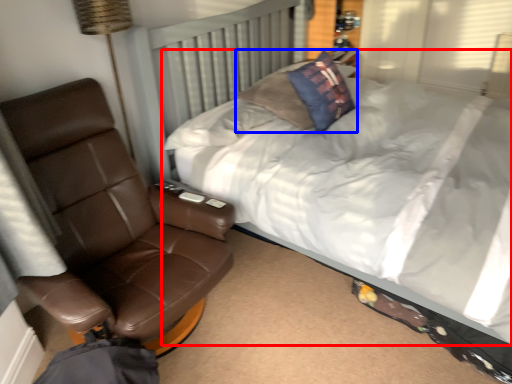
Question: Which object is closer to the camera taking this photo, bed (highlighted by a red box) or pillow (highlighted by a blue box)?

Choices:
 (A) bed
 (B) pillow

Answer: (A)